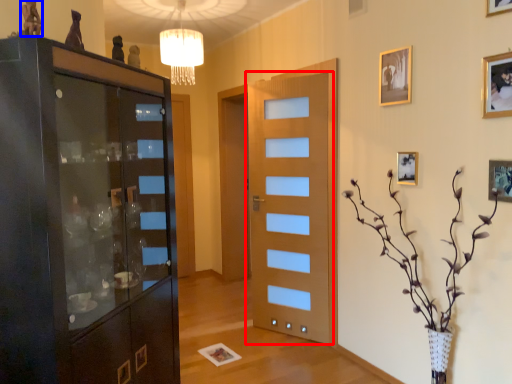
Question: Which of the following is the farthest to the observer, door (highlighted by a red box) or art (highlighted by a blue box)?

Choices:
 (A) door
 (B) art

Answer: (A)